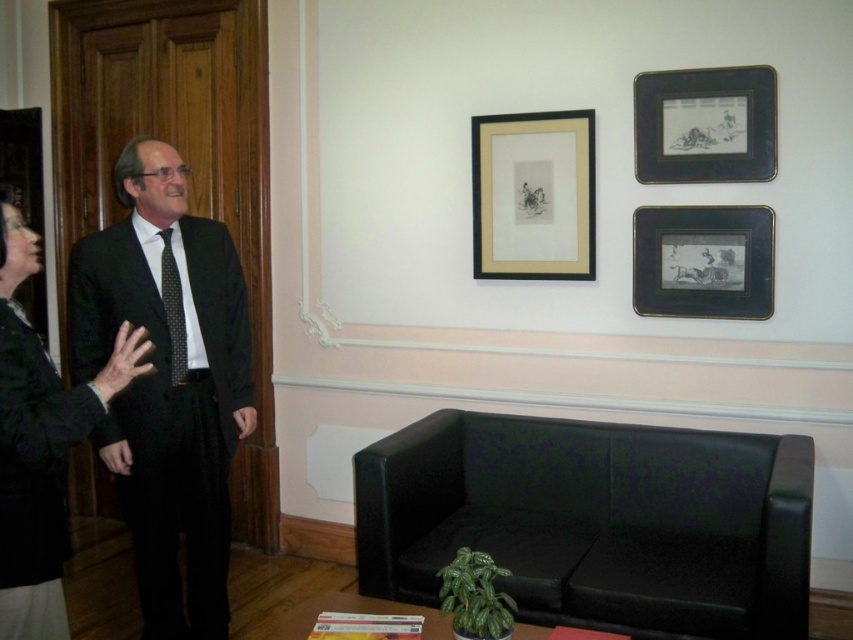
Question: Is black leather couch at lower right above black matte picture frame at center-right?

Choices:
 (A) yes
 (B) no

Answer: (B)

Question: Which of these objects is positioned farthest from the gold matte picture frame at center?

Choices:
 (A) matte black suit at left
 (B) black matte picture frame at center-right
 (C) black matte picture frame at upper right

Answer: (A)

Question: Does black leather couch at lower right appear on the left side of matte black suit at left?

Choices:
 (A) yes
 (B) no

Answer: (B)

Question: Which of these objects is positioned farthest from the black matte picture frame at upper right?

Choices:
 (A) gold matte picture frame at center
 (B) black dotted tie at center
 (C) black matte picture frame at center-right
 (D) matte black suit at left

Answer: (B)

Question: Does black textured jacket at left have a lesser width compared to gold matte picture frame at center?

Choices:
 (A) yes
 (B) no

Answer: (A)

Question: Considering the real-world distances, which object is farthest from the black textured jacket at left?

Choices:
 (A) matte black suit at left
 (B) black matte picture frame at center-right
 (C) black leather couch at lower right

Answer: (B)